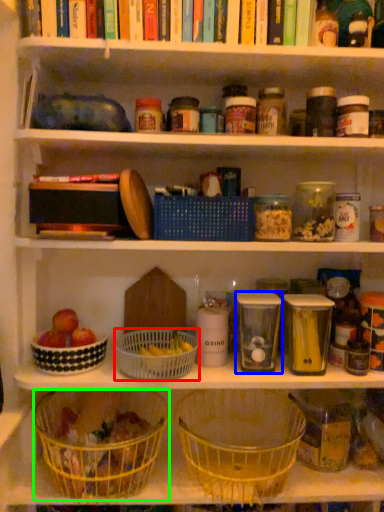
Question: Based on their relative distances, which object is nearer to basket (highlighted by a red box)? Choose from glass jar (highlighted by a blue box) and basket (highlighted by a green box).

Choices:
 (A) glass jar
 (B) basket

Answer: (B)